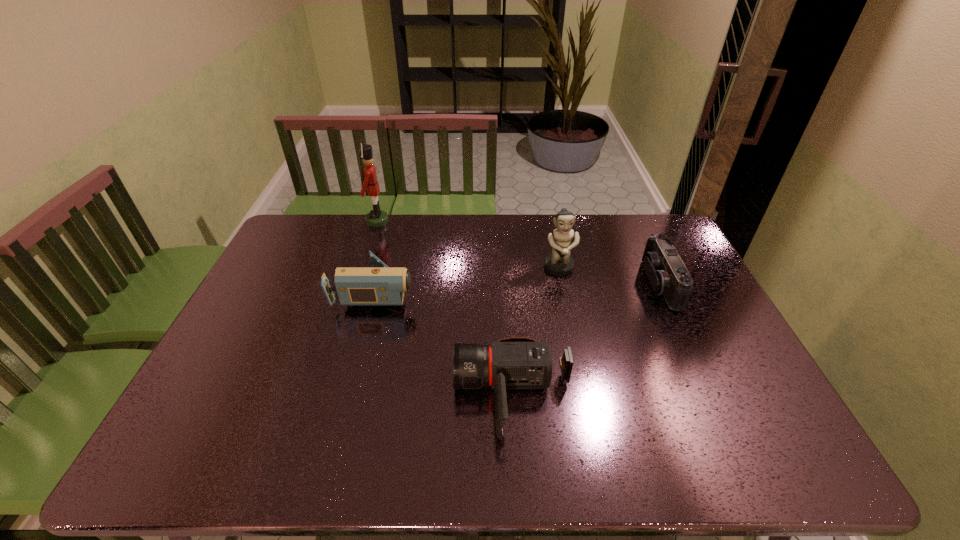
The width and height of the screenshot is (960, 540). What are the coordinates of `the farthest object` in the screenshot? It's located at (375, 218).

In order to click on nutcracker in this screenshot , I will do `click(375, 218)`.

Where is `the second tallest object`? The width and height of the screenshot is (960, 540). the second tallest object is located at coordinates (559, 263).

At what (x,y) coordinates should I click in order to perform the action: click on the leftmost camcorder. Please return your answer as a coordinate pair (x, y). Looking at the image, I should click on (379, 285).

Where is `the rightmost camcorder`? This screenshot has width=960, height=540. the rightmost camcorder is located at coordinates (668, 275).

At what (x,y) coordinates should I click in order to perform the action: click on the second camcorder from left to right. Please return your answer as a coordinate pair (x, y). The width and height of the screenshot is (960, 540). Looking at the image, I should click on [x=516, y=362].

Where is `the nearest object`? This screenshot has width=960, height=540. the nearest object is located at coordinates (516, 362).

Identify the location of free location located 0.210m on the front-facing side of the nutcracker. The image size is (960, 540). (444, 221).

Locate an element on the screen. This screenshot has width=960, height=540. blank space located 0.280m on the front-facing side of the figurine is located at coordinates (576, 346).

I want to click on vacant space located on the side of the leftmost camcorder with the flip-out screen, so coord(442,291).